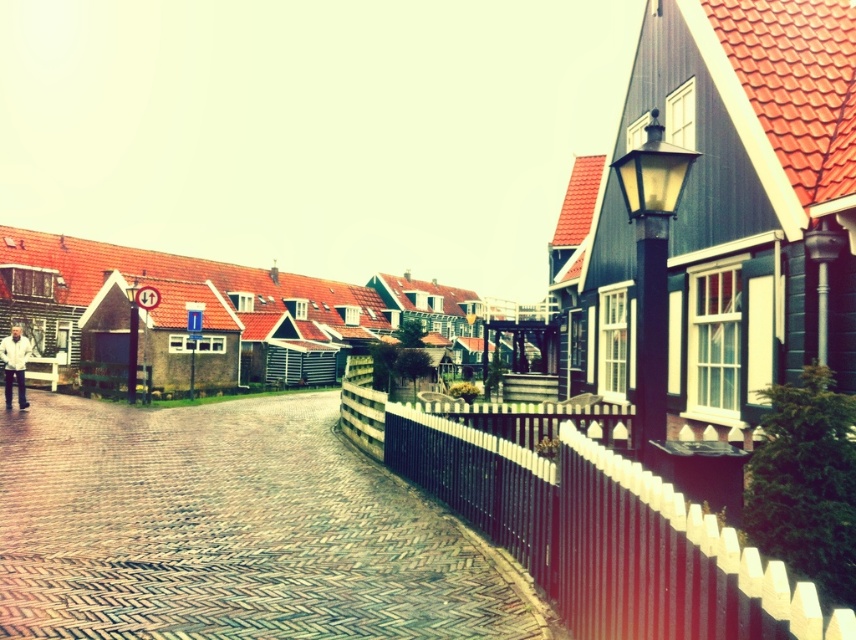
Question: Observing the image, what is the correct spatial positioning of black wooden fence at right in reference to white matte jacket at left?

Choices:
 (A) above
 (B) below

Answer: (B)

Question: Does black wooden fence at right have a larger size compared to white matte jacket at left?

Choices:
 (A) no
 (B) yes

Answer: (A)

Question: Can you confirm if brown brick path at center is bigger than white matte jacket at left?

Choices:
 (A) no
 (B) yes

Answer: (A)

Question: Considering the real-world distances, which object is farthest from the white matte jacket at left?

Choices:
 (A) brown brick path at center
 (B) black wooden fence at right

Answer: (B)

Question: Which point is closer to the camera taking this photo?

Choices:
 (A) (419, 440)
 (B) (302, 420)
 (C) (24, 369)

Answer: (A)

Question: Which point is closer to the camera?

Choices:
 (A) (613, 557)
 (B) (9, 371)

Answer: (A)